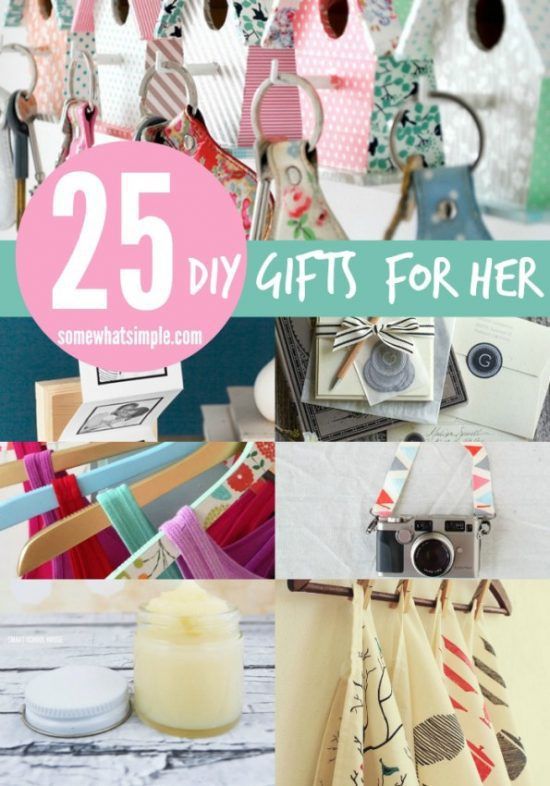
The image size is (550, 786). What are the coordinates of `hanger` in the screenshot? It's located at (236, 487), (183, 472), (164, 457), (79, 454), (7, 454).